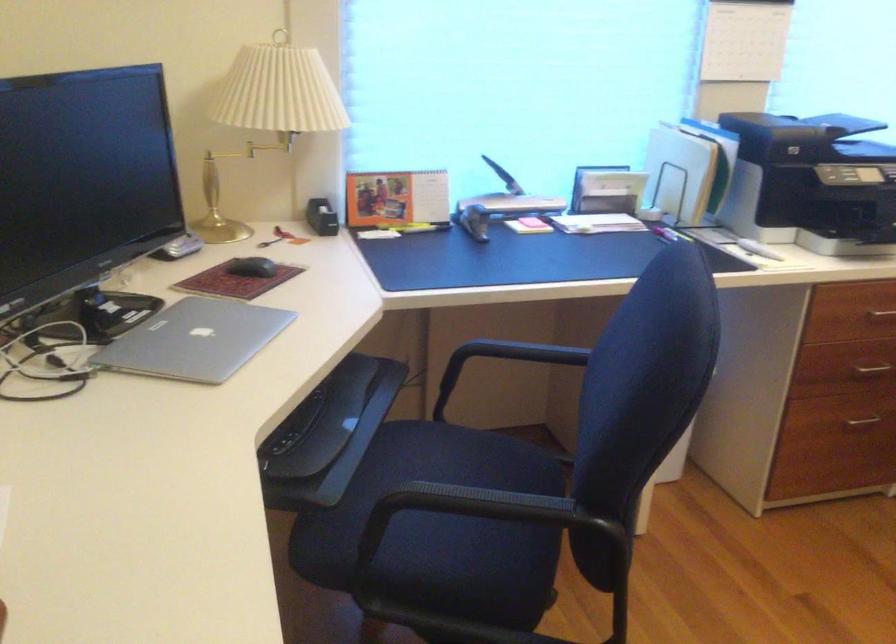
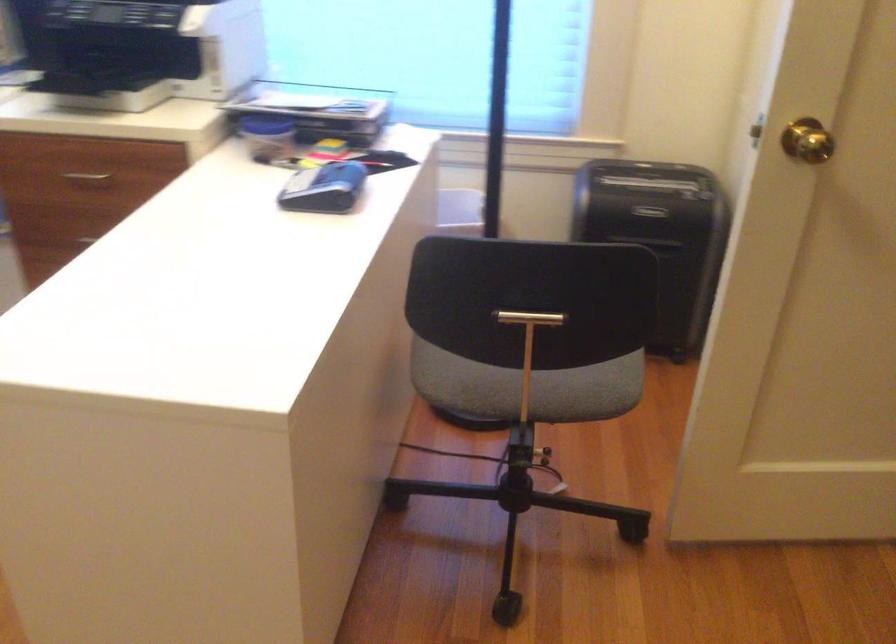
Question: The images are taken continuously from a first-person perspective. In which direction are you moving?

Choices:
 (A) Left
 (B) Right
 (C) Forward
 (D) Backward

Answer: (B)